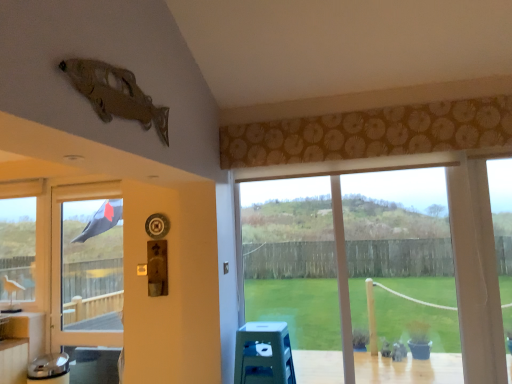
Question: Considering the relative sizes of transparent glass window at center, marked as the second window in a left-to-right arrangement, and clear glass window at left, arranged as the 1th window when viewed from the back, in the image provided, is transparent glass window at center, marked as the second window in a left-to-right arrangement, taller than clear glass window at left, arranged as the 1th window when viewed from the back,?

Choices:
 (A) no
 (B) yes

Answer: (B)

Question: From a real-world perspective, does transparent glass window at center, positioned as the 1th window in right-to-left order, stand above clear glass window at left, the first window positioned from the left?

Choices:
 (A) no
 (B) yes

Answer: (A)

Question: From a real-world perspective, is transparent glass window at center, the second window viewed from the back, positioned under clear glass window at left, arranged as the second window when viewed from the front, based on gravity?

Choices:
 (A) no
 (B) yes

Answer: (B)

Question: Does transparent glass window at center, marked as the second window in a left-to-right arrangement, have a lesser width compared to clear glass window at left, arranged as the 1th window when viewed from the back?

Choices:
 (A) yes
 (B) no

Answer: (A)

Question: Would you say transparent glass window at center, marked as the second window in a left-to-right arrangement, contains clear glass window at left, arranged as the second window when viewed from the front?

Choices:
 (A) yes
 (B) no

Answer: (B)

Question: Would you consider transparent glass window at center, the 1th window when ordered from front to back, to be distant from clear glass window at left, which is the 2th window from right to left?

Choices:
 (A) yes
 (B) no

Answer: (A)

Question: Can you confirm if black fabric screen door at left is bigger than blue plastic stool at lower center?

Choices:
 (A) no
 (B) yes

Answer: (B)

Question: Can you confirm if black fabric screen door at left is smaller than blue plastic stool at lower center?

Choices:
 (A) no
 (B) yes

Answer: (A)

Question: Is black fabric screen door at left aimed at blue plastic stool at lower center?

Choices:
 (A) yes
 (B) no

Answer: (B)

Question: From a real-world perspective, is black fabric screen door at left positioned over blue plastic stool at lower center based on gravity?

Choices:
 (A) yes
 (B) no

Answer: (A)

Question: From the image's perspective, is black fabric screen door at left located beneath blue plastic stool at lower center?

Choices:
 (A) no
 (B) yes

Answer: (A)

Question: Does black fabric screen door at left contain blue plastic stool at lower center?

Choices:
 (A) no
 (B) yes

Answer: (A)

Question: From a real-world perspective, is transparent glass window at center, positioned as the 1th window in right-to-left order, located higher than blue plastic stool at lower center?

Choices:
 (A) yes
 (B) no

Answer: (A)